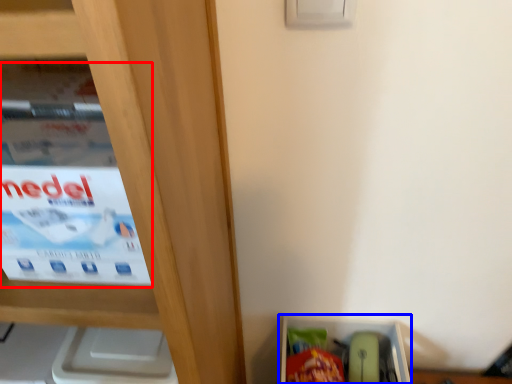
Question: Among these objects, which one is farthest to the camera, paperback book (highlighted by a red box) or storage box (highlighted by a blue box)?

Choices:
 (A) paperback book
 (B) storage box

Answer: (B)